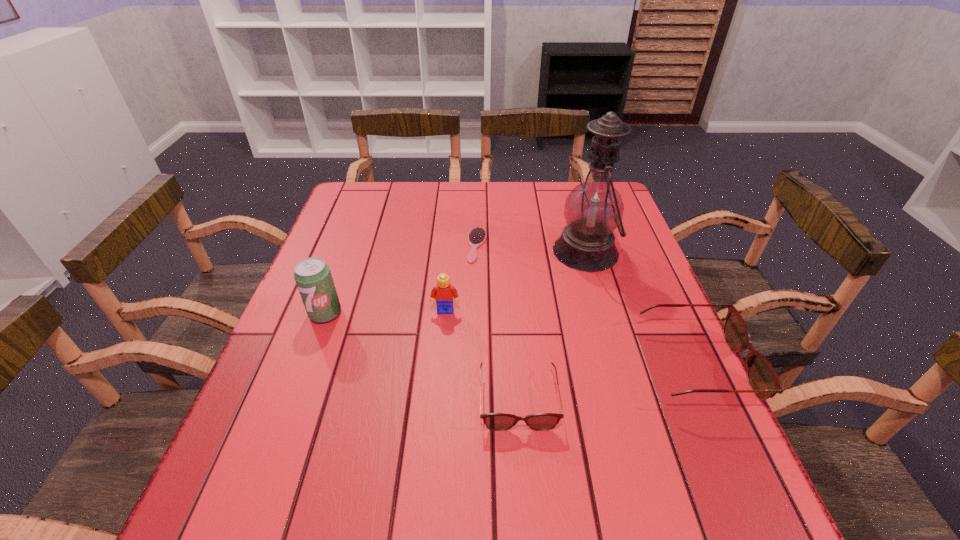
The width and height of the screenshot is (960, 540). In order to click on blank space located on the right of the shortest object in this screenshot , I will do `click(564, 245)`.

Where is `vacant space located on the front of the oil lamp`? This screenshot has height=540, width=960. vacant space located on the front of the oil lamp is located at coordinates (629, 399).

This screenshot has width=960, height=540. What are the coordinates of `vacant space located 0.220m on the front of the second tallest object` in the screenshot? It's located at (290, 409).

Find the location of a particular element. Image resolution: width=960 pixels, height=540 pixels. free region located 0.170m on the front-facing side of the Lego is located at coordinates (441, 374).

This screenshot has width=960, height=540. I want to click on object located in the near edge section of the desktop, so click(494, 421).

At what (x,y) coordinates should I click in order to perform the action: click on object that is at the left edge. Please return your answer as a coordinate pair (x, y). Looking at the image, I should click on click(x=312, y=275).

Locate an element on the screen. spectacles that is at the right edge is located at coordinates (763, 379).

You are a GUI agent. You are given a task and a screenshot of the screen. Output one action in this format:
    pyautogui.click(x=<x>, y=<y>)
    Task: Click on the oil lamp present at the right edge
    
    Given the screenshot: What is the action you would take?
    pyautogui.click(x=593, y=210)

In the image, there is a desktop. Where is `vacant space at the far edge`? The image size is (960, 540). vacant space at the far edge is located at coordinates coord(398,209).

Find the location of a particular element. free point at the near edge is located at coordinates point(422,465).